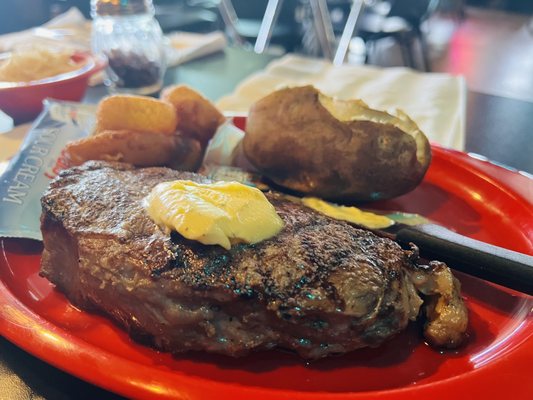
Where is `glass`? Image resolution: width=533 pixels, height=400 pixels. glass is located at coordinates (132, 39).